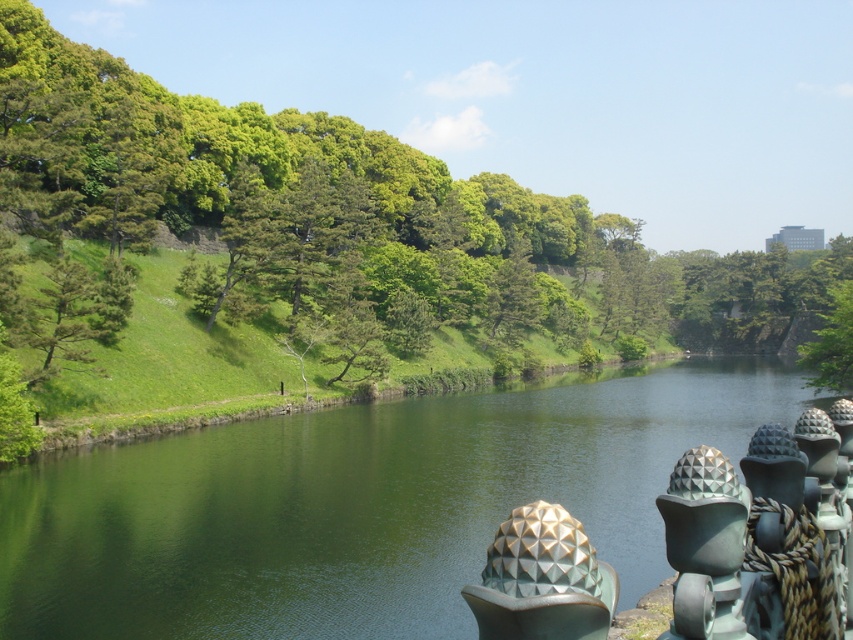
You are standing at the edge of the water and want to take a photo of the green leafy tree at center. If your camera has a maximum zoom range of 40 meters, will you be able to capture the tree clearly?

The green leafy tree at center is 39.63 meters from the camera. Since the camera can zoom up to 40 meters, it is just within range, so yes, you can capture the tree clearly.

You are standing at point [280,225] and want to reach the other side of the water. The path you choose must be exactly 70.53 meters long. Can you walk straight from your current position to the opposite bank without deviating? Explain your reasoning.

Yes, because the distance between point [280,225] and the opposite bank is exactly 70.53 meters, so walking straight would cover the required distance precisely.

You are a small boat operator who wants to navigate through the green smooth water at center. There is a polished bronze sphere at lower right nearby. Can you safely pass between them without hitting the sphere?

The green smooth water at center might be wider than polished bronze sphere at lower right, so there is a possibility that the boat can pass safely. However, the exact width is uncertain based on the given information.